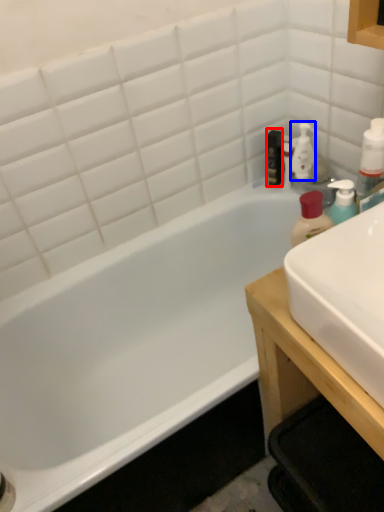
Question: Among these objects, which one is farthest to the camera, mouthwash (highlighted by a red box) or cleaning product (highlighted by a blue box)?

Choices:
 (A) mouthwash
 (B) cleaning product

Answer: (A)